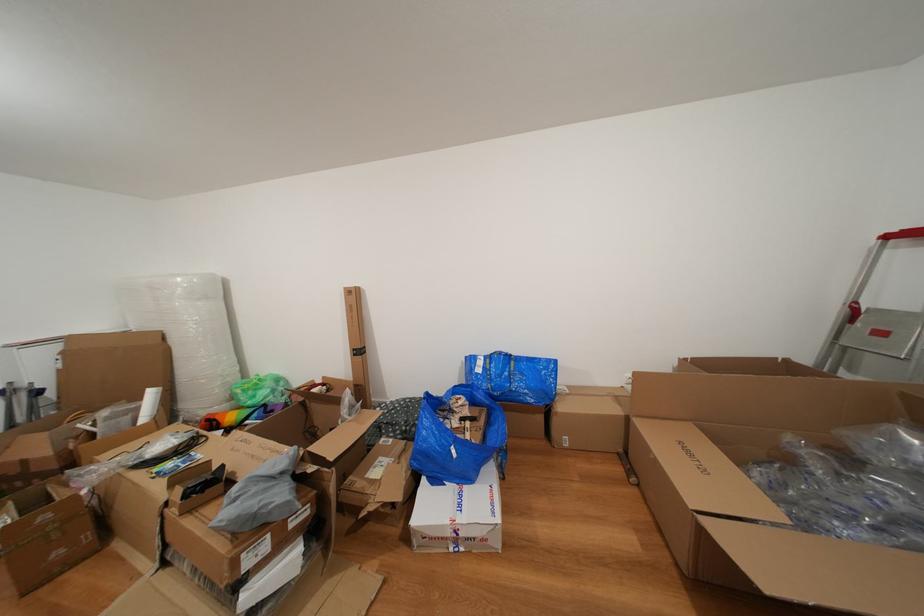
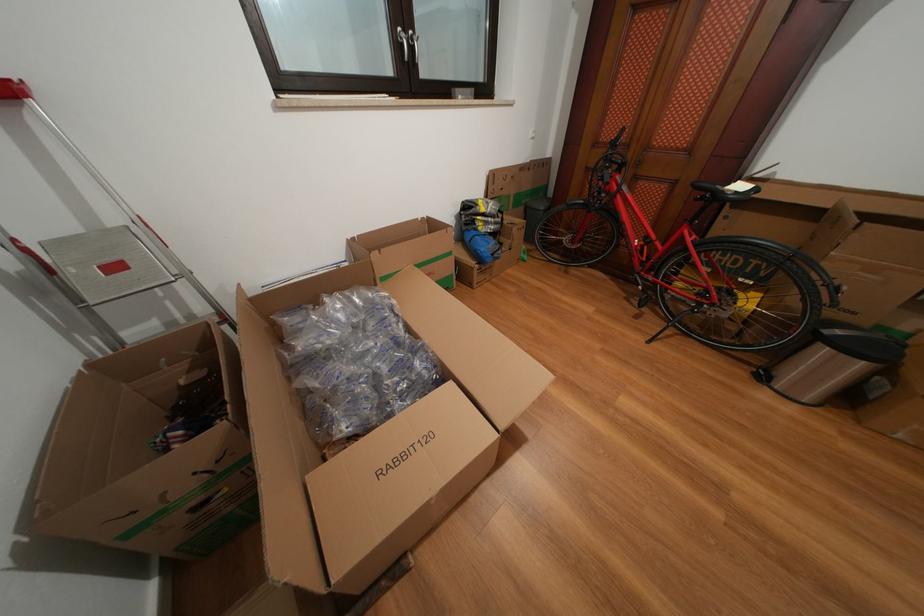
Where in the second image is the point corresponding to (x=890, y=339) from the first image?

(124, 273)